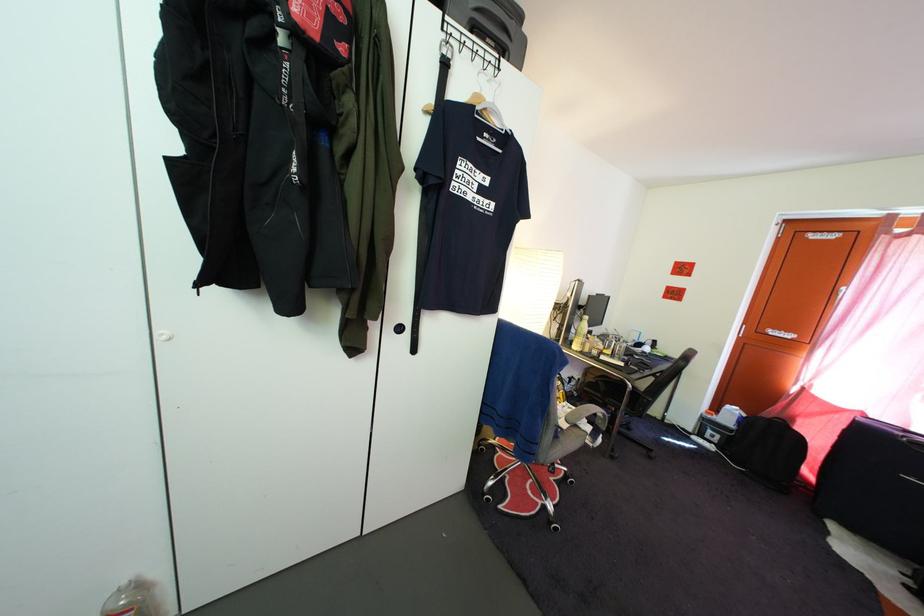
You are a GUI agent. You are given a task and a screenshot of the screen. Output one action in this format:
    pyautogui.click(x=<x>, y=<y>)
    Task: Click on the silver door latch
    
    Given the screenshot: What is the action you would take?
    pyautogui.click(x=857, y=371)